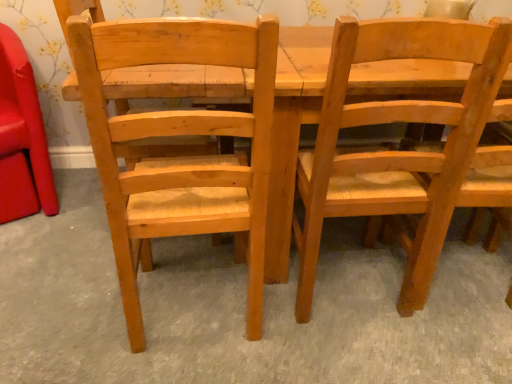
The height and width of the screenshot is (384, 512). What are the coordinates of `vacant space to the right of natural wood chair at left, which appears as the second chair when viewed from the left` in the screenshot? It's located at (306, 334).